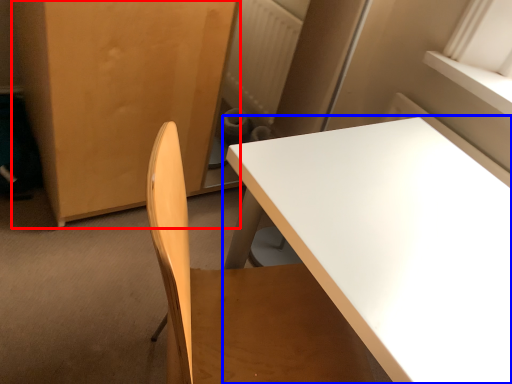
Question: Among these objects, which one is nearest to the camera, armoire (highlighted by a red box) or table (highlighted by a blue box)?

Choices:
 (A) armoire
 (B) table

Answer: (B)